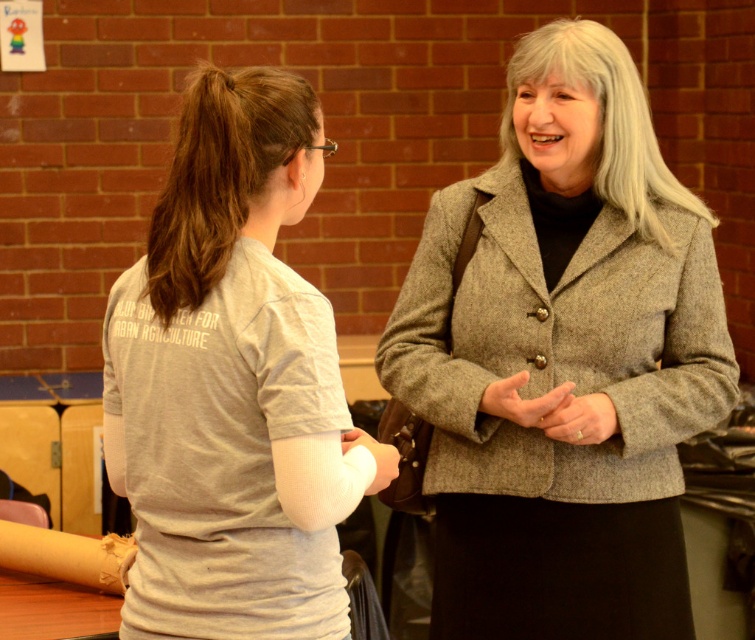
You are standing in front of the two people in the image. The person on the right is wearing a matte gray blazer at center. If you want to hand a document to the person on the right, where should you approach them from?

The matte gray blazer at center is located at point (562, 358), so you should approach the person on the right from the right side to hand them the document.

You are a photographer standing 5 feet away from the camera. You want to take a photo of the matte gray blazer at center. Can you reach the camera in time to capture the blazer before the subjects move?

The matte gray blazer at center and camera are 6.18 feet apart from each other. Since you are already 5 feet away from the camera, you are within reach to capture the matte gray blazer at center before the subjects move.